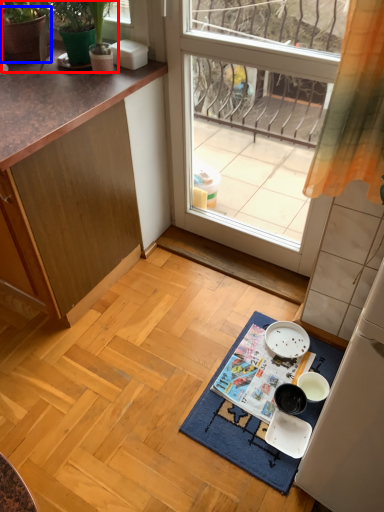
Question: Among these objects, which one is farthest to the camera, plant (highlighted by a red box) or flowerpot (highlighted by a blue box)?

Choices:
 (A) plant
 (B) flowerpot

Answer: (B)